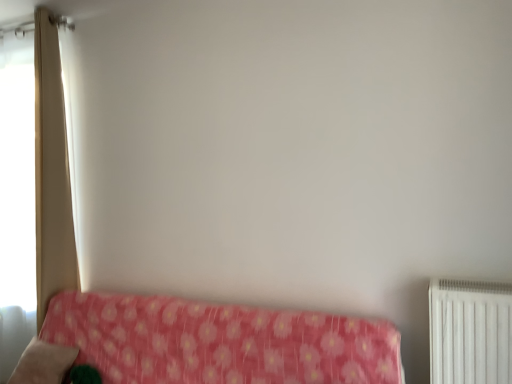
You are a GUI agent. You are given a task and a screenshot of the screen. Output one action in this format:
    pyautogui.click(x=<x>, y=<y>)
    Task: Click on the vacant space situated above beige fabric curtain at left (from a real-world perspective)
    
    Given the screenshot: What is the action you would take?
    pyautogui.click(x=37, y=11)